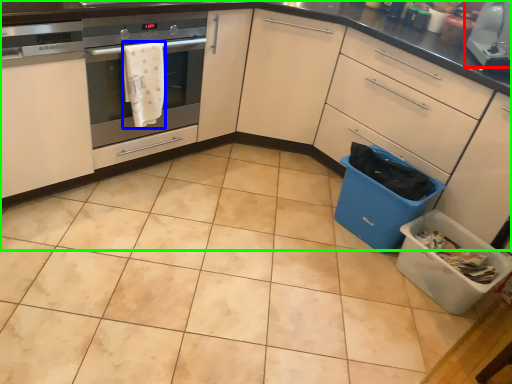
Question: Which is nearer to the kitchen appliance (highlighted by a red box)? material (highlighted by a blue box) or cabinetry (highlighted by a green box).

Choices:
 (A) material
 (B) cabinetry

Answer: (B)